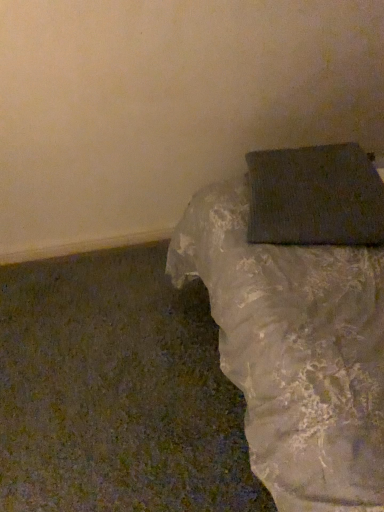
Question: Is matte gray box at upper right bigger or smaller than matte gray wrapping paper at lower right?

Choices:
 (A) small
 (B) big

Answer: (B)

Question: Considering the relative positions of matte gray box at upper right and matte gray wrapping paper at lower right in the image provided, is matte gray box at upper right to the left or to the right of matte gray wrapping paper at lower right?

Choices:
 (A) right
 (B) left

Answer: (A)

Question: In terms of height, does matte gray box at upper right look taller or shorter compared to matte gray wrapping paper at lower right?

Choices:
 (A) short
 (B) tall

Answer: (B)

Question: From the image's perspective, relative to matte gray box at upper right, is matte gray wrapping paper at lower right above or below?

Choices:
 (A) above
 (B) below

Answer: (A)

Question: Is matte gray wrapping paper at lower right taller or shorter than matte gray box at upper right?

Choices:
 (A) tall
 (B) short

Answer: (B)

Question: Based on their positions, is matte gray wrapping paper at lower right located to the left or right of matte gray box at upper right?

Choices:
 (A) left
 (B) right

Answer: (A)

Question: Based on their sizes in the image, would you say matte gray wrapping paper at lower right is bigger or smaller than matte gray box at upper right?

Choices:
 (A) small
 (B) big

Answer: (A)